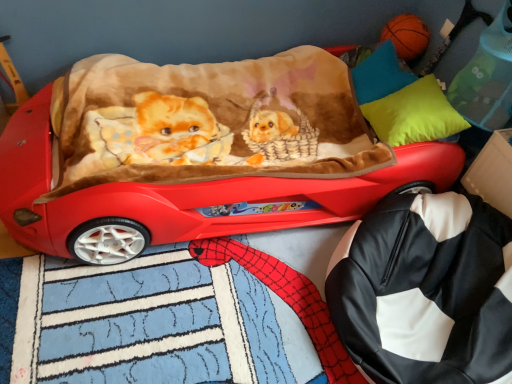
What do you see at coordinates (426, 290) in the screenshot?
I see `black leather bag at lower right` at bounding box center [426, 290].

Locate an element on the screen. shiny red car at center is located at coordinates (207, 193).

This screenshot has height=384, width=512. Identify the location of matte blue pillow at upper right, the 2th pillow when ordered from bottom to top. click(x=380, y=75).

There is a shiny red car at center. At what (x,y) coordinates should I click in order to perform the action: click on the 1st pillow above it (from a real-world perspective). Please return your answer as a coordinate pair (x, y). Image resolution: width=512 pixels, height=384 pixels. Looking at the image, I should click on (380, 75).

Does matte blue pillow at upper right, positioned as the 1th pillow in top-to-bottom order, have a lesser width compared to shiny red car at center?

Indeed, matte blue pillow at upper right, positioned as the 1th pillow in top-to-bottom order, has a lesser width compared to shiny red car at center.

Which is in front, point (358, 87) or point (34, 192)?

The point (34, 192) is more forward.

Does black leather bag at lower right have a smaller size compared to matte blue pillow at upper right, positioned as the 1th pillow in top-to-bottom order?

No, black leather bag at lower right is not smaller than matte blue pillow at upper right, positioned as the 1th pillow in top-to-bottom order.

Which object is closer to the camera taking this photo, black leather bag at lower right or matte blue pillow at upper right, positioned as the 1th pillow in top-to-bottom order?

black leather bag at lower right is more forward.

Looking at this image, is black leather bag at lower right at the right side of matte blue pillow at upper right, the 2th pillow when ordered from bottom to top?

Yes.

Where is `the 2nd pillow behind when counting from the black leather bag at lower right`? The width and height of the screenshot is (512, 384). the 2nd pillow behind when counting from the black leather bag at lower right is located at coordinates (380, 75).

Image resolution: width=512 pixels, height=384 pixels. I want to click on bag that appears below the shiny red car at center (from the image's perspective), so click(x=426, y=290).

Can you confirm if black leather bag at lower right is smaller than shiny red car at center?

Yes, black leather bag at lower right is smaller than shiny red car at center.

Which is less distant, (509, 322) or (15, 225)?

Positioned in front is point (509, 322).

Considering the relative positions of shiny red car at center and matte blue pillow at upper right, positioned as the 1th pillow in top-to-bottom order, in the image provided, is shiny red car at center to the left of matte blue pillow at upper right, positioned as the 1th pillow in top-to-bottom order, from the viewer's perspective?

Yes, shiny red car at center is to the left of matte blue pillow at upper right, positioned as the 1th pillow in top-to-bottom order.

Considering the sizes of objects shiny red car at center and matte blue pillow at upper right, the 2th pillow when ordered from bottom to top, in the image provided, who is taller, shiny red car at center or matte blue pillow at upper right, the 2th pillow when ordered from bottom to top,?

Standing taller between the two is shiny red car at center.

Is shiny red car at center surrounding matte blue pillow at upper right, the 2th pillow when ordered from bottom to top?

Yes, matte blue pillow at upper right, the 2th pillow when ordered from bottom to top, is a part of shiny red car at center.

Is shiny red car at center further to the viewer compared to matte blue pillow at upper right, the 2th pillow when ordered from bottom to top?

No, shiny red car at center is closer to the viewer.

How many degrees apart are the facing directions of black leather bag at lower right and neon yellow fabric pillow at upper right, the second pillow in the top-to-bottom sequence?

8.17 degrees separate the facing orientations of black leather bag at lower right and neon yellow fabric pillow at upper right, the second pillow in the top-to-bottom sequence.

Starting from the black leather bag at lower right, which pillow is the 1st one behind? Please provide its 2D coordinates.

[(414, 114)]

Considering the sizes of objects black leather bag at lower right and neon yellow fabric pillow at upper right, which ranks as the first pillow in bottom-to-top order, in the image provided, who is wider, black leather bag at lower right or neon yellow fabric pillow at upper right, which ranks as the first pillow in bottom-to-top order,?

With larger width is black leather bag at lower right.

Considering their positions, is black leather bag at lower right located in front of or behind neon yellow fabric pillow at upper right, which ranks as the first pillow in bottom-to-top order?

Clearly, black leather bag at lower right is in front of neon yellow fabric pillow at upper right, which ranks as the first pillow in bottom-to-top order.

Is shiny red car at center aimed at neon yellow fabric pillow at upper right, which ranks as the first pillow in bottom-to-top order?

No.

Is shiny red car at center bigger or smaller than neon yellow fabric pillow at upper right, which ranks as the first pillow in bottom-to-top order?

In the image, shiny red car at center appears to be larger than neon yellow fabric pillow at upper right, which ranks as the first pillow in bottom-to-top order.

Would you say shiny red car at center is inside or outside neon yellow fabric pillow at upper right, which ranks as the first pillow in bottom-to-top order?

shiny red car at center is located beyond the bounds of neon yellow fabric pillow at upper right, which ranks as the first pillow in bottom-to-top order.

In the image, there is a neon yellow fabric pillow at upper right, the second pillow in the top-to-bottom sequence. Where is `car below it (from a real-world perspective)`? car below it (from a real-world perspective) is located at coordinates (207, 193).

Is matte blue pillow at upper right, the 2th pillow when ordered from bottom to top, facing away from black leather bag at lower right?

That's not correct — matte blue pillow at upper right, the 2th pillow when ordered from bottom to top, is not looking away from black leather bag at lower right.

Considering the positions of points (371, 83) and (382, 290), is point (371, 83) closer to camera compared to point (382, 290)?

No, it is behind (382, 290).

In terms of width, does matte blue pillow at upper right, positioned as the 1th pillow in top-to-bottom order, look wider or thinner when compared to black leather bag at lower right?

In the image, matte blue pillow at upper right, positioned as the 1th pillow in top-to-bottom order, appears to be more narrow than black leather bag at lower right.

Which object is closer to the camera taking this photo, matte blue pillow at upper right, positioned as the 1th pillow in top-to-bottom order, or black leather bag at lower right?

Positioned in front is black leather bag at lower right.

From the shiny red car at center, count 2nd pillows backward and point to it. Please provide its 2D coordinates.

[(380, 75)]

Identify the location of the 1st pillow above the black leather bag at lower right (from a real-world perspective). (380, 75).

Based on their spatial positions, is shiny red car at center or black leather bag at lower right closer to neon yellow fabric pillow at upper right, which ranks as the first pillow in bottom-to-top order?

shiny red car at center lies closer to neon yellow fabric pillow at upper right, which ranks as the first pillow in bottom-to-top order, than the other object.

Which object lies nearer to the anchor point matte blue pillow at upper right, positioned as the 1th pillow in top-to-bottom order, neon yellow fabric pillow at upper right, the second pillow in the top-to-bottom sequence, or shiny red car at center?

neon yellow fabric pillow at upper right, the second pillow in the top-to-bottom sequence.

Which object lies further to the anchor point neon yellow fabric pillow at upper right, the second pillow in the top-to-bottom sequence, matte blue pillow at upper right, positioned as the 1th pillow in top-to-bottom order, or black leather bag at lower right?

black leather bag at lower right is positioned further to the anchor neon yellow fabric pillow at upper right, the second pillow in the top-to-bottom sequence.

Which object lies further to the anchor point matte blue pillow at upper right, the 2th pillow when ordered from bottom to top, shiny red car at center or black leather bag at lower right?

black leather bag at lower right is further to matte blue pillow at upper right, the 2th pillow when ordered from bottom to top.

From the image, which object appears to be farther from shiny red car at center, neon yellow fabric pillow at upper right, which ranks as the first pillow in bottom-to-top order, or black leather bag at lower right?

black leather bag at lower right is positioned further to the anchor shiny red car at center.

Looking at this image, considering their positions, is matte blue pillow at upper right, the 2th pillow when ordered from bottom to top, positioned further to neon yellow fabric pillow at upper right, the second pillow in the top-to-bottom sequence, than shiny red car at center?

Based on the image, shiny red car at center appears to be further to neon yellow fabric pillow at upper right, the second pillow in the top-to-bottom sequence.

Considering their positions, is black leather bag at lower right positioned further to shiny red car at center than matte blue pillow at upper right, positioned as the 1th pillow in top-to-bottom order?

matte blue pillow at upper right, positioned as the 1th pillow in top-to-bottom order, lies further to shiny red car at center than the other object.

Which object lies nearer to the anchor point matte blue pillow at upper right, the 2th pillow when ordered from bottom to top, neon yellow fabric pillow at upper right, the second pillow in the top-to-bottom sequence, or black leather bag at lower right?

neon yellow fabric pillow at upper right, the second pillow in the top-to-bottom sequence, is closer to matte blue pillow at upper right, the 2th pillow when ordered from bottom to top.

Image resolution: width=512 pixels, height=384 pixels. What are the coordinates of `pillow located between shiny red car at center and neon yellow fabric pillow at upper right, which ranks as the first pillow in bottom-to-top order, in the left-right direction` in the screenshot? It's located at (380, 75).

I want to click on car between matte blue pillow at upper right, the 2th pillow when ordered from bottom to top, and black leather bag at lower right, in the vertical direction, so click(x=207, y=193).

The image size is (512, 384). In order to click on pillow between matte blue pillow at upper right, the 2th pillow when ordered from bottom to top, and black leather bag at lower right, in the vertical direction in this screenshot , I will do `click(414, 114)`.